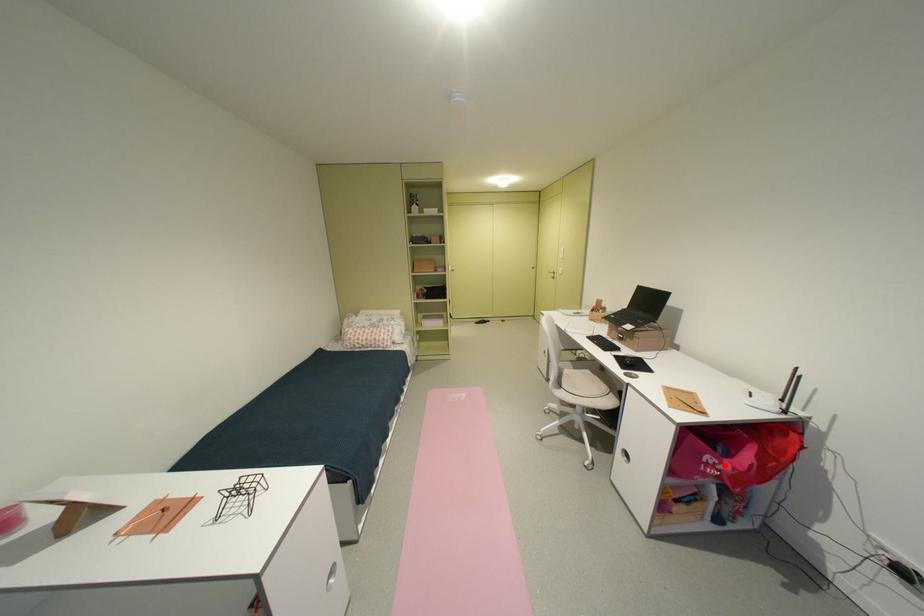
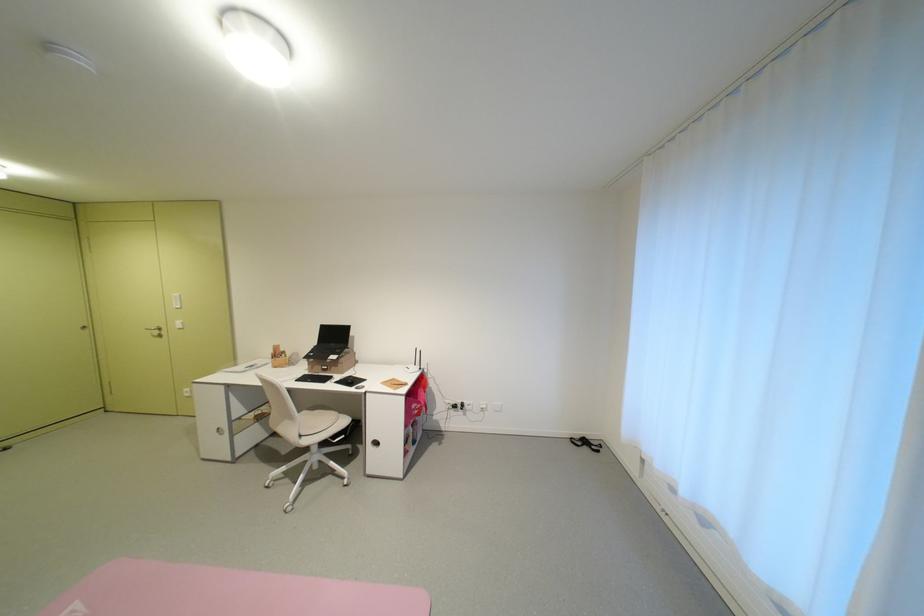
Question: I am providing you with two images of the same scene from different viewpoints. Given a red point in image1, look at the same physical point in image2. Is it:

Choices:
 (A) Closer to the viewpoint
 (B) Farther from the viewpoint

Answer: (A)